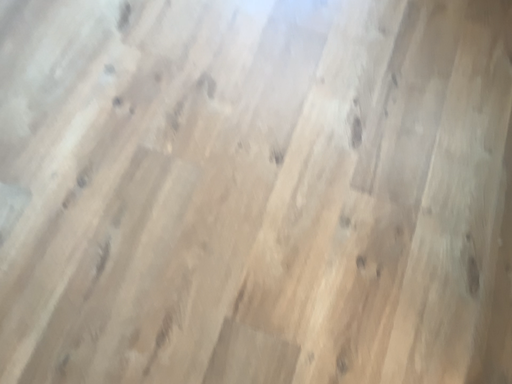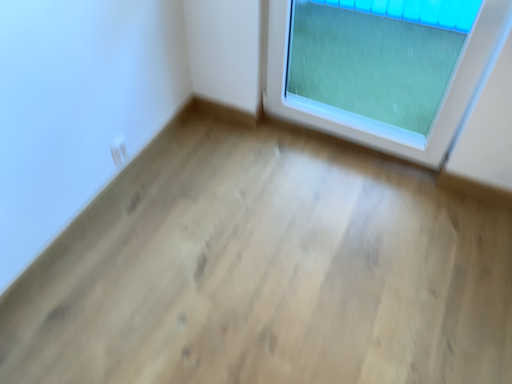
Question: How did the camera likely rotate when shooting the video?

Choices:
 (A) rotated downward
 (B) rotated upward

Answer: (B)